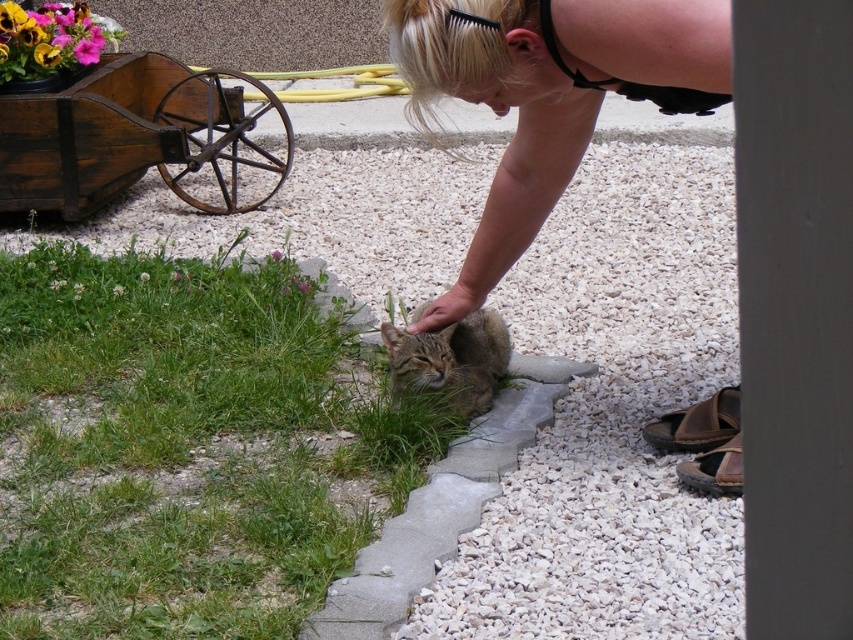
Looking at this image, you are a photographer standing at the center of the scene. You want to take a picture of the blonde hair at upper center. Where should you aim your camera to capture it?

The blonde hair at upper center is located at point coordinates of 0.150 on the x axis and 0.644 on the y axis, so you should aim your camera at those coordinates to capture it.

You are a photographer standing at the edge of the white gravel area. You want to take a photo of the tabby fur cat at center and the green grass at lower left. Which object should you focus on first if you want to capture both in the same frame without moving your camera?

The green grass at lower left is wider than the tabby fur cat at center, so you should focus on the tabby fur cat at center first to ensure both fit in the frame.

You are standing at the center of the image. Looking towards the lower left, you see a point marked at coordinates (184, 445). What is located at this point?

The point at coordinates (184, 445) indicates green grass at lower left.